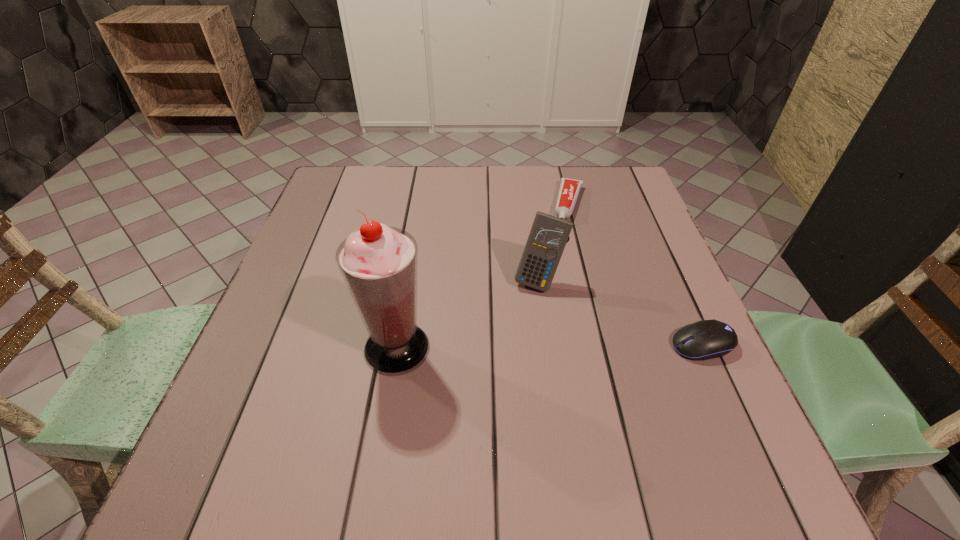
Locate an element on the screen. free spot between the rightmost object and the toothpaste is located at coordinates (636, 274).

Find the location of a particular element. The height and width of the screenshot is (540, 960). blank region between the smoothie and the toothpaste is located at coordinates (483, 276).

Find the location of a particular element. This screenshot has width=960, height=540. vacant space that is in between the tallest object and the computer mouse is located at coordinates (550, 346).

Identify which object is the third nearest to the leftmost object. Please provide its 2D coordinates. Your answer should be formatted as a tuple, i.e. [(x, y)], where the tuple contains the x and y coordinates of a point satisfying the conditions above.

[(707, 339)]

I want to click on object that can be found as the third closest to the computer mouse, so click(379, 264).

The height and width of the screenshot is (540, 960). Find the location of `blank space that satisfies the following two spatial constraints: 1. on the back side of the smoothie; 2. on the right side of the rightmost object`. blank space that satisfies the following two spatial constraints: 1. on the back side of the smoothie; 2. on the right side of the rightmost object is located at coordinates (397, 344).

The image size is (960, 540). Find the location of `free spot that satisfies the following two spatial constraints: 1. on the back side of the toothpaste; 2. on the left side of the smoothie`. free spot that satisfies the following two spatial constraints: 1. on the back side of the toothpaste; 2. on the left side of the smoothie is located at coordinates (421, 204).